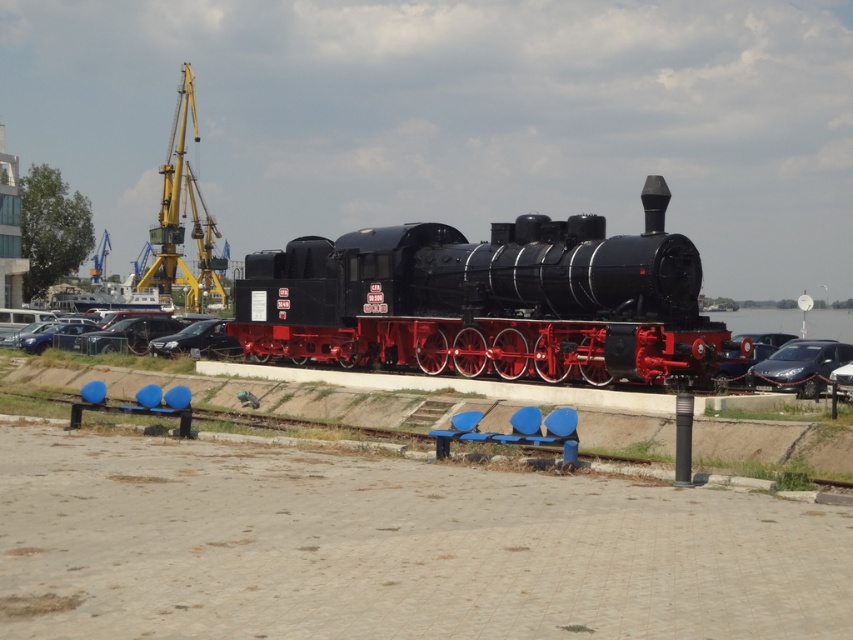
You are standing on the paved walkway leading to the vintage steam locomotive. You see a shiny silver sedan at right and a satin black car at center. Which car is closer to the water?

The shiny silver sedan at right is located below the satin black car at center, so it is closer to the water.

You are standing at the point marked as point (834, 360). You need to reach the other point which is 27.49 meters away. Is there enough space between the blue benches along the walkway to move freely towards your destination?

The two points are 27.49 meters apart. Since the blue benches are placed along the walkway, there should be sufficient space between them to move freely towards the destination as long as you navigate around or between the benches appropriately.

You are standing at the start of the paved walkway in the foreground. The blue benches are along the walkway. If you walk straight towards the polished black locomotive at center, will you reach it before reaching the industrial cranes in the background?

The polished black locomotive at center is located at point (x=488, y=300), which is closer to the foreground compared to the industrial cranes in the background. Therefore, walking straight towards it, you will reach the polished black locomotive at center before the industrial cranes.